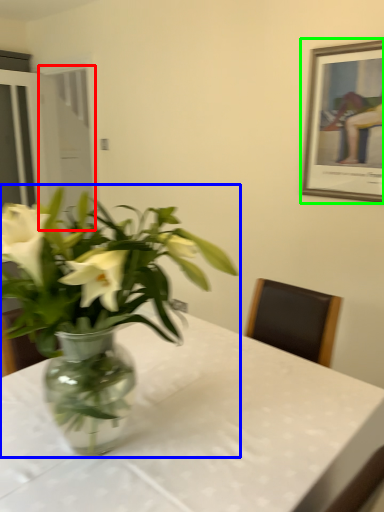
Question: Which object is the farthest from glass door (highlighted by a red box)? Choose among these: houseplant (highlighted by a blue box) or picture frame (highlighted by a green box).

Choices:
 (A) houseplant
 (B) picture frame

Answer: (A)